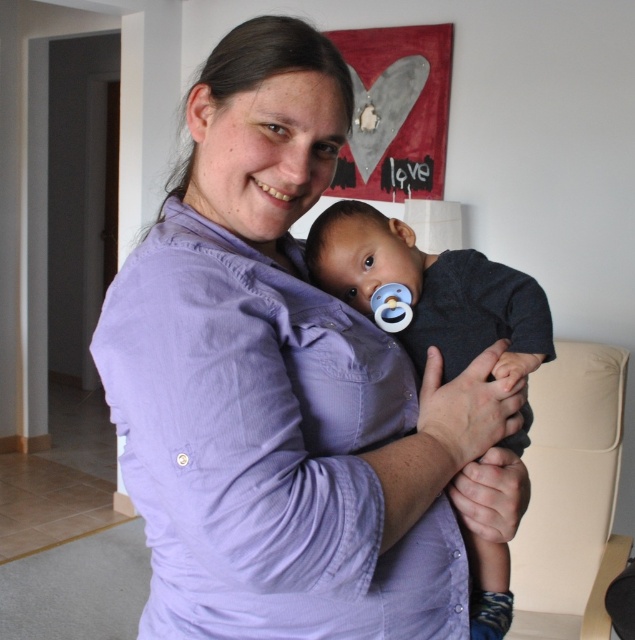
Question: Which object is farther from the camera taking this photo?

Choices:
 (A) purple cotton shirt at center
 (B) dark blue fabric baby at center

Answer: (B)

Question: Which point is closer to the camera taking this photo?

Choices:
 (A) (187, 499)
 (B) (530, 288)

Answer: (A)

Question: Which of the following is the closest to the observer?

Choices:
 (A) purple cotton shirt at center
 (B) dark blue fabric baby at center

Answer: (A)

Question: Is purple cotton shirt at center above dark blue fabric baby at center?

Choices:
 (A) no
 (B) yes

Answer: (B)

Question: Where is purple cotton shirt at center located in relation to dark blue fabric baby at center in the image?

Choices:
 (A) above
 (B) below

Answer: (A)

Question: Where is purple cotton shirt at center located in relation to dark blue fabric baby at center in the image?

Choices:
 (A) right
 (B) left

Answer: (B)